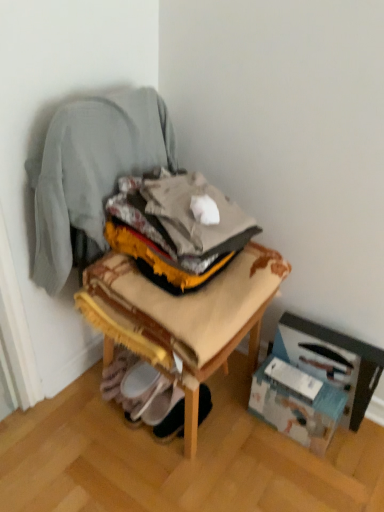
Where is `free space to the left of white cardboard box at lower right, which appears as the first cardboard box when viewed from the right`? The width and height of the screenshot is (384, 512). free space to the left of white cardboard box at lower right, which appears as the first cardboard box when viewed from the right is located at coordinates (242, 416).